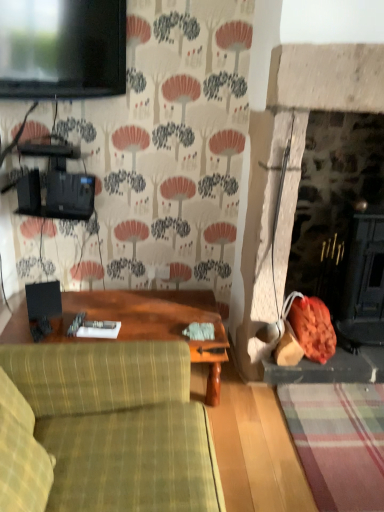
The width and height of the screenshot is (384, 512). Find the location of `vacant space underneath matte black tv at upper left (from a real-world perspective)`. vacant space underneath matte black tv at upper left (from a real-world perspective) is located at coordinates (86, 298).